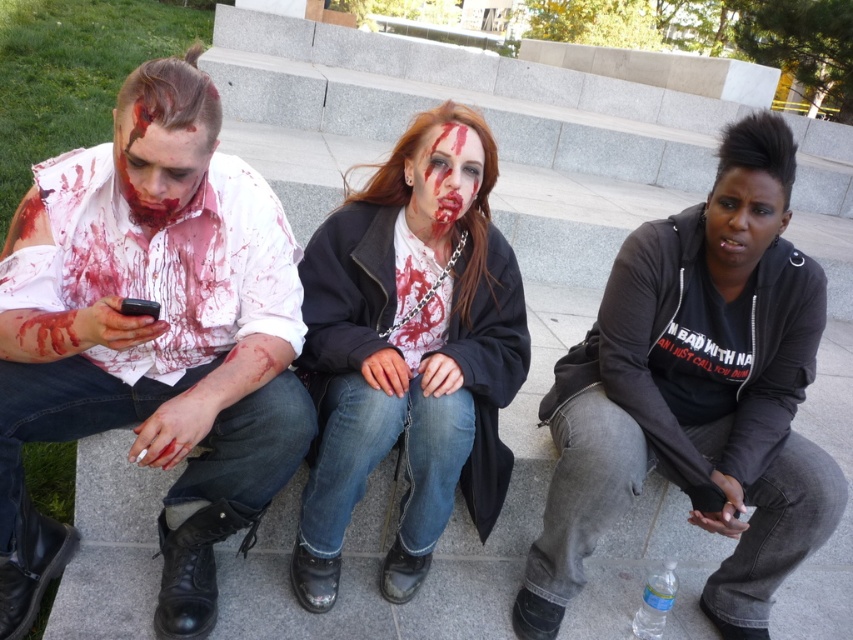
Does matte white shirt at left have a greater width compared to blood-stained face at center?

Yes, matte white shirt at left is wider than blood-stained face at center.

How distant is matte white shirt at left from blood-stained face at center?

They are 64.98 centimeters apart.

Describe the element at coordinates (149, 337) in the screenshot. I see `matte white shirt at left` at that location.

At what (x,y) coordinates should I click in order to perform the action: click on matte white shirt at left. Please return your answer as a coordinate pair (x, y). This screenshot has height=640, width=853. Looking at the image, I should click on (149, 337).

Is matte black coat at center positioned at the back of matte white face at left?

Yes, matte black coat at center is further from the viewer.

Is the position of matte black coat at center less distant than that of matte white face at left?

No, it is not.

Identify the location of matte black coat at center. Image resolution: width=853 pixels, height=640 pixels. (409, 349).

What are the coordinates of `black matte face at center` in the screenshot? It's located at (741, 221).

Does black matte face at center have a greater width compared to blood-stained face at center?

Yes, black matte face at center is wider than blood-stained face at center.

This screenshot has width=853, height=640. Find the location of `black matte face at center`. black matte face at center is located at coordinates (741, 221).